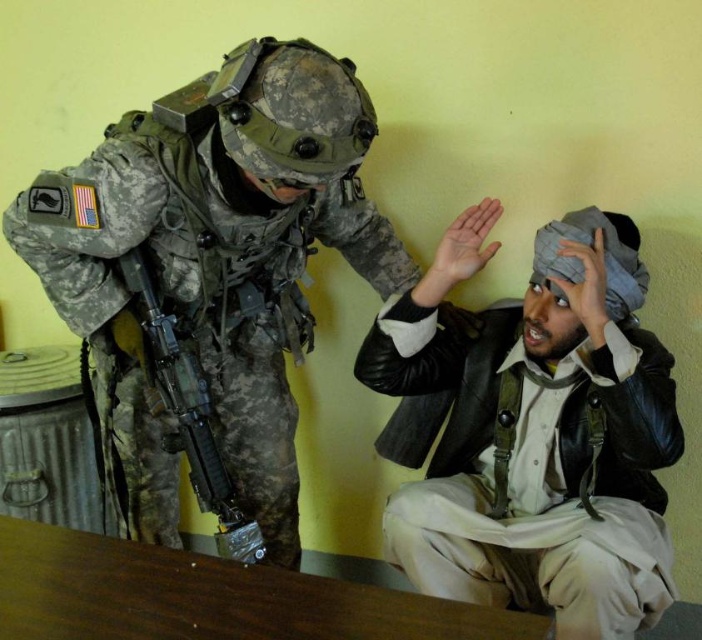
Based on the scene description, which object is positioned lower in the image, the leather jacket at center or the camouflage fabric uniform at left?

The leather jacket at center is positioned below the camouflage fabric uniform at left, so it is lower in the image.

Where is the leather jacket at center located in the image?

The leather jacket at center is located at point (x=536, y=432) in the image.

You are a security guard observing two individuals in an indoor setting. The person on the left is wearing a camouflage fabric uniform and has a matte black rifle slung over their shoulder. The person on the right is seated with their hands raised. Based on the description provided, which object is taller between the camouflage fabric uniform at left and the matte black rifle at left?

The camouflage fabric uniform at left is taller than the matte black rifle at left according to the description provided.